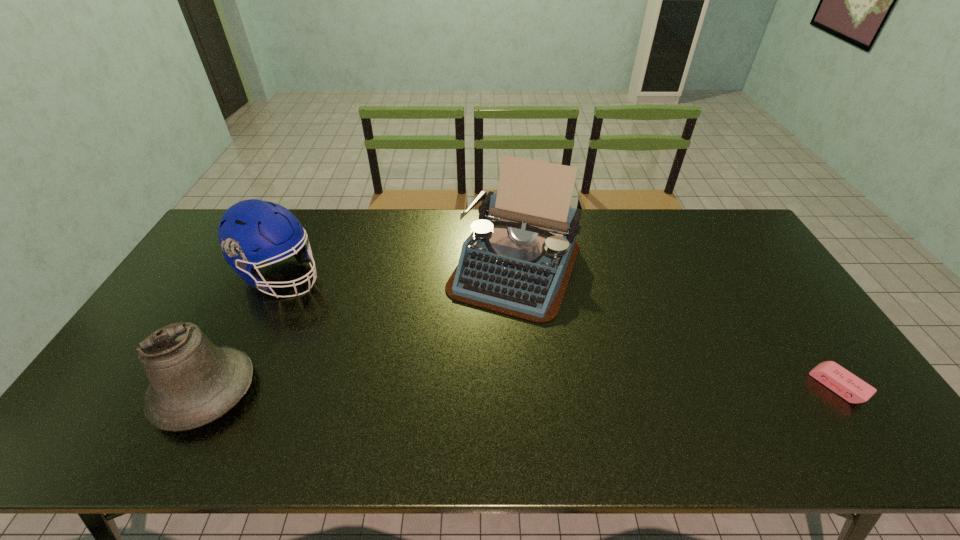
Find the location of a particular element. This screenshot has height=540, width=960. vacant area situated on the typing side of the typewriter is located at coordinates (450, 412).

This screenshot has width=960, height=540. Identify the location of free location located on the typing side of the typewriter. (485, 336).

The image size is (960, 540). Find the location of `free space located 0.090m on the typing side of the typewriter`. free space located 0.090m on the typing side of the typewriter is located at coordinates (483, 341).

Identify the location of object that is at the far edge. Image resolution: width=960 pixels, height=540 pixels. (518, 260).

At what (x,y) coordinates should I click in order to perform the action: click on bell that is at the near edge. Please return your answer as a coordinate pair (x, y). The image size is (960, 540). Looking at the image, I should click on (193, 382).

You are a GUI agent. You are given a task and a screenshot of the screen. Output one action in this format:
    pyautogui.click(x=<x>, y=<y>)
    Task: Click on the eraser that is at the near edge
    
    Given the screenshot: What is the action you would take?
    pyautogui.click(x=845, y=384)

Find the location of `object present at the left edge`. object present at the left edge is located at coordinates (193, 382).

Identify the location of object that is at the right edge. (845, 384).

At what (x,y) coordinates should I click in order to perform the action: click on object positioned at the near left corner. Please return your answer as a coordinate pair (x, y). Looking at the image, I should click on (193, 382).

The width and height of the screenshot is (960, 540). I want to click on object that is at the near right corner, so click(x=845, y=384).